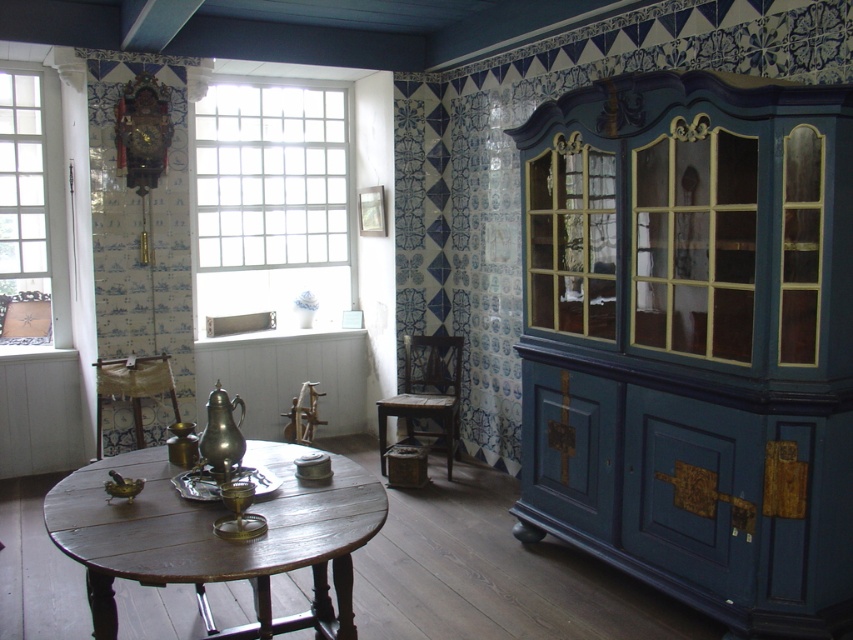
You are standing in the room and want to move from the clear glass window at left to the wooden polished table at center. Which direction should you move in?

You should move to the right to reach the wooden polished table at center from the clear glass window at left, as the wooden polished table at center is positioned to the right of the clear glass window at left.

In the scene shown: You are standing in the room and want to take a photo of the wooden polished table at center. If your camera has a maximum focus range of 7 feet, will it be able to capture the table clearly?

The wooden polished table at center and camera are 7.01 feet apart, which is slightly beyond the camera maximum focus range of 7 feet. Therefore, the camera will not be able to capture the table clearly.

You are sitting on the wooden chair at center and want to look out through the clear glass window at left. Can you see the window clearly from your current position?

The clear glass window at left is further to the viewer than wooden chair at center, so yes, you can see the clear glass window at left clearly from your current position on the wooden chair at center.